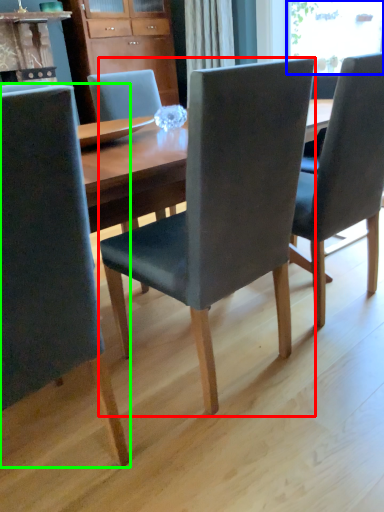
Question: Considering the real-world distances, which object is closest to chair (highlighted by a red box)? window screen (highlighted by a blue box) or chair (highlighted by a green box).

Choices:
 (A) window screen
 (B) chair

Answer: (B)